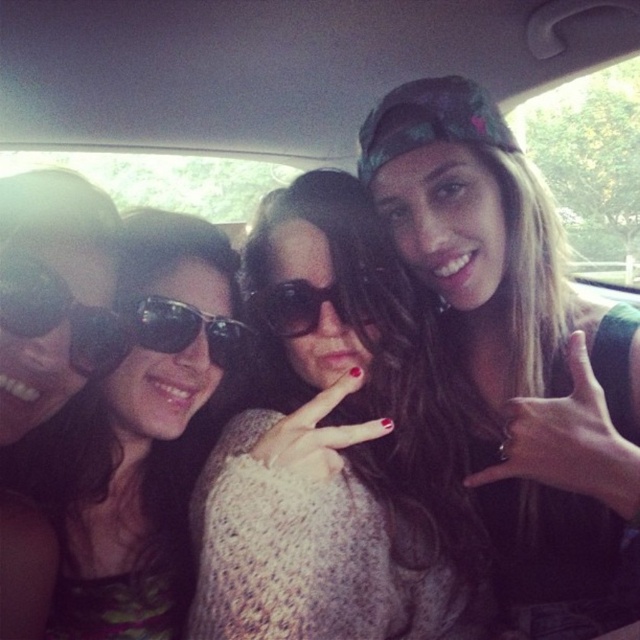
Can you confirm if black reflective sunglasses at center is smaller than sunglasses at center?

No, black reflective sunglasses at center is not smaller than sunglasses at center.

Does black reflective sunglasses at center come behind sunglasses at center?

No, it is not.

Image resolution: width=640 pixels, height=640 pixels. What are the coordinates of `black reflective sunglasses at center` in the screenshot? It's located at (184, 328).

Does knitted sweater at center have a smaller size compared to matte black sunglasses at left?

Incorrect, knitted sweater at center is not smaller in size than matte black sunglasses at left.

Between knitted sweater at center and matte black sunglasses at left, which one appears on the left side from the viewer's perspective?

From the viewer's perspective, matte black sunglasses at left appears more on the left side.

What do you see at coordinates (333, 449) in the screenshot? This screenshot has width=640, height=640. I see `knitted sweater at center` at bounding box center [333, 449].

Locate an element on the screen. knitted sweater at center is located at coordinates (333, 449).

Does knitted sweater at center appear on the right side of black reflective sunglasses at center?

Correct, you'll find knitted sweater at center to the right of black reflective sunglasses at center.

Measure the distance between point (x=323, y=616) and camera.

28.35 inches

Is point (332, 243) farther from viewer compared to point (141, 332)?

No, it is not.

Identify the location of knitted sweater at center. (333, 449).